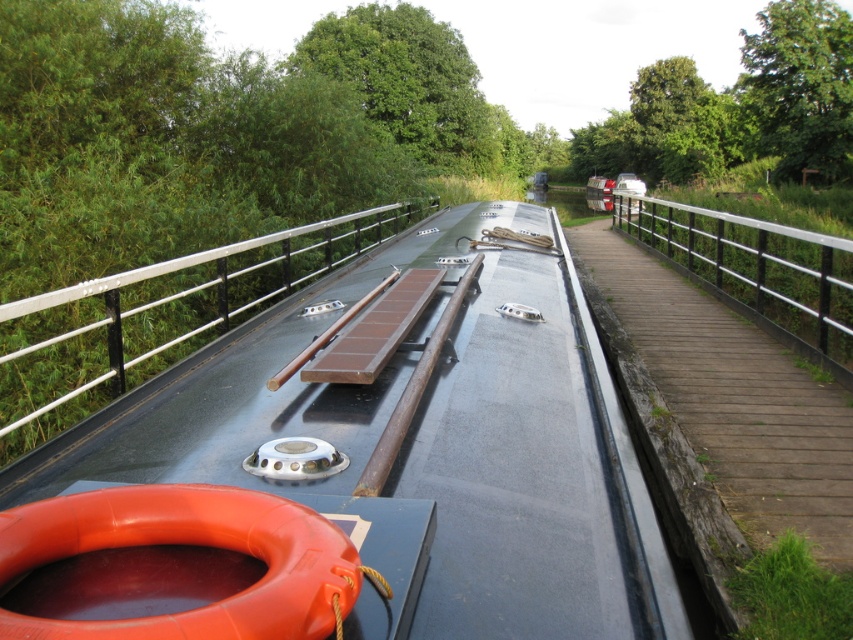
You are standing on the wooden walkway next to the metallic gray boat at center. You want to board the boat. Which direction should you move relative to the silver metallic rail at center to reach the boat?

Since the metallic gray boat at center is above the silver metallic rail at center, you should move towards the boat in the upward direction relative to the rail to board it.

You are standing on the wooden walkway next to the narrowboat and notice two points marked on the deck. The first point is at coordinates point [161,275] and the second is at point [817,349]. From your perspective on the walkway, which point is closer to you?

Point [161,275] is behind point [817,349], so the point closer to you on the walkway is point [817,349].